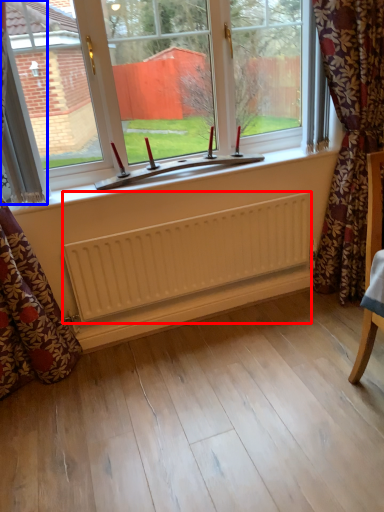
Question: Which object appears farthest to the camera in this image, radiator (highlighted by a red box) or curtain (highlighted by a blue box)?

Choices:
 (A) radiator
 (B) curtain

Answer: (A)